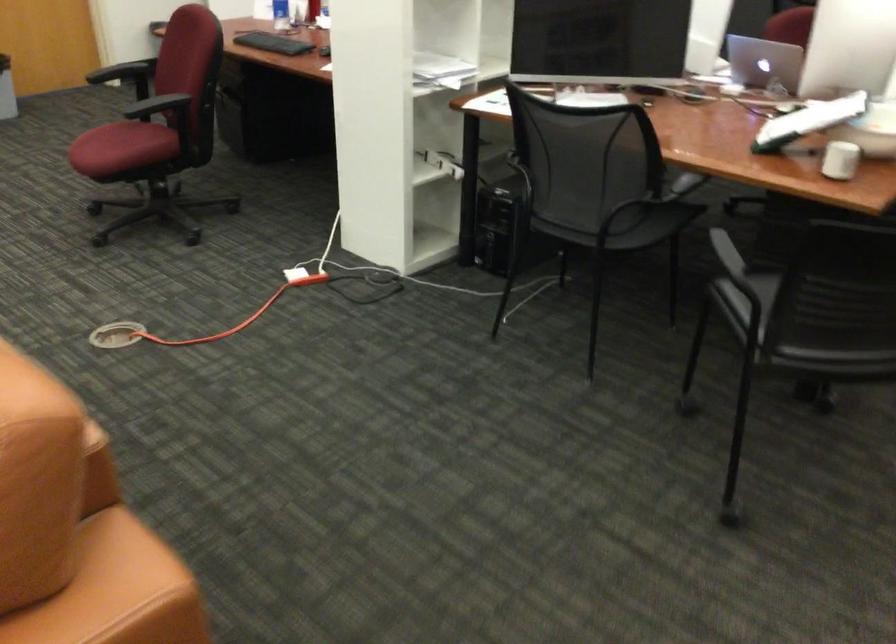
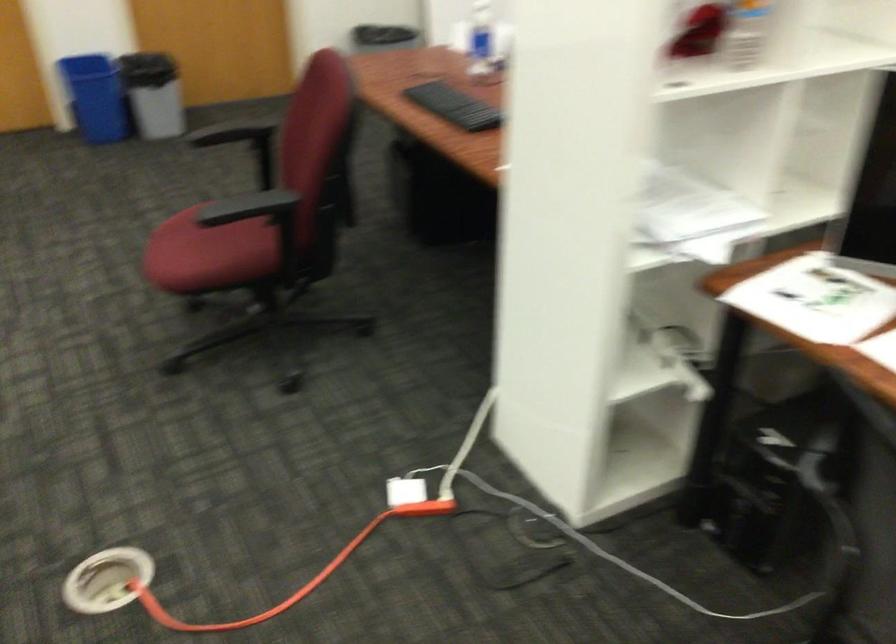
Question: The images are taken continuously from a first-person perspective. In which direction are you moving?

Choices:
 (A) Left
 (B) Right
 (C) Forward
 (D) Backward

Answer: (C)